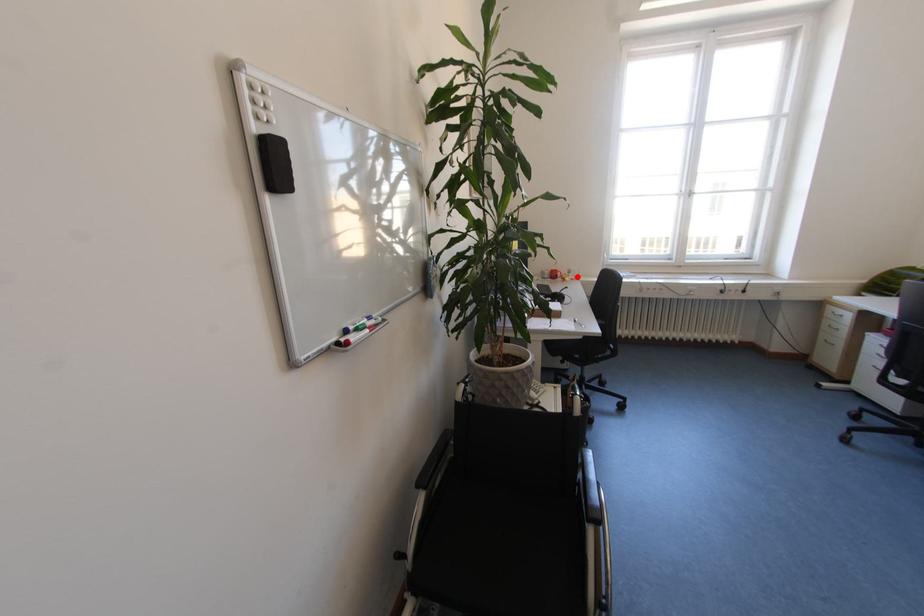
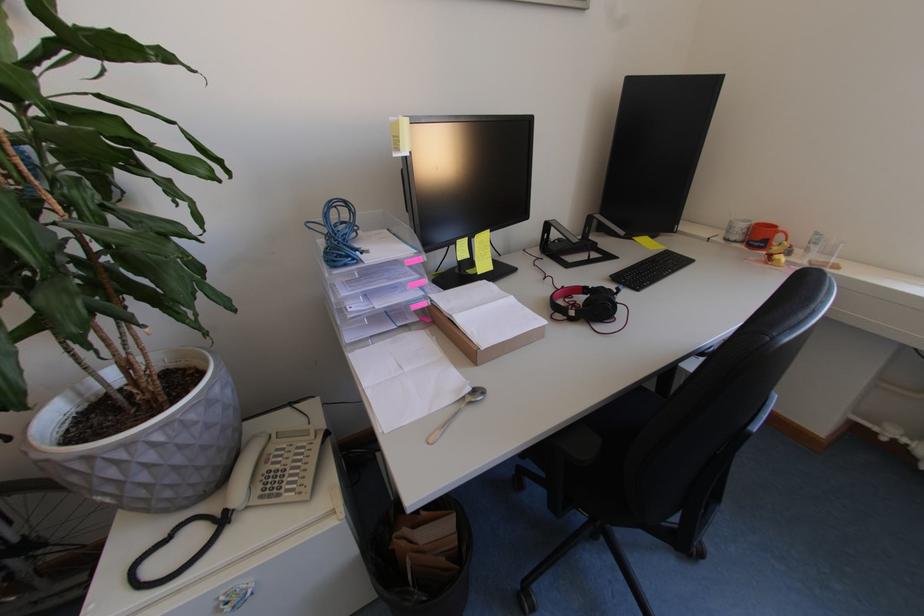
Question: I am providing you with two images of the same scene from different viewpoints. A red point is marked on the first image. At the location where the point appears in image 1, is it still visible in image 2?

Choices:
 (A) Yes
 (B) No

Answer: (A)